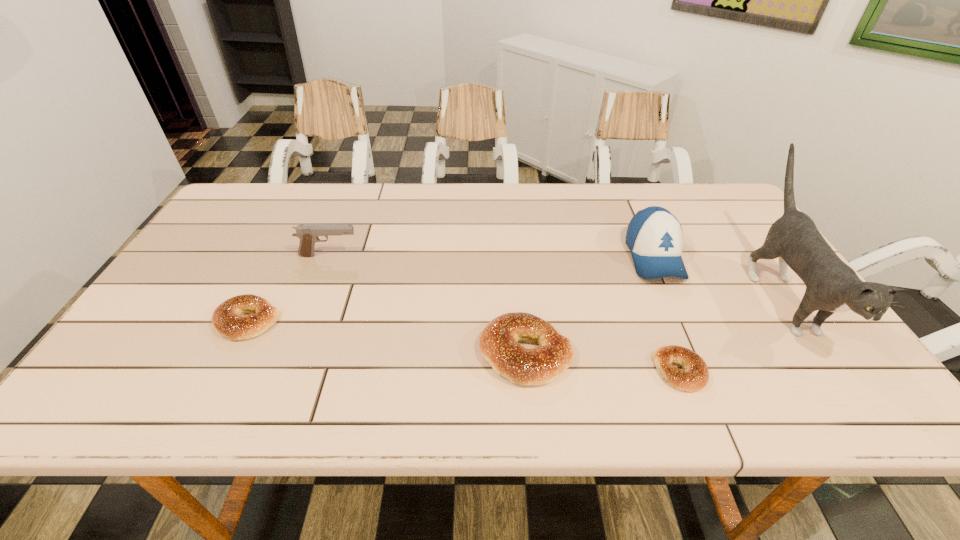
Where is `free space located on the back of the second shortest object`? Image resolution: width=960 pixels, height=540 pixels. free space located on the back of the second shortest object is located at coordinates (281, 255).

Identify the location of free space located 0.350m on the back of the third object from left to right. The height and width of the screenshot is (540, 960). (515, 233).

You are a GUI agent. You are given a task and a screenshot of the screen. Output one action in this format:
    pyautogui.click(x=<x>, y=<y>)
    Task: Click on the vacant region located 0.160m on the left of the shortest object
    
    Given the screenshot: What is the action you would take?
    (x=582, y=371)

Find the location of a particular element. vacant space located at the barrel of the fourth shortest object is located at coordinates tap(384, 255).

At what (x,y) coordinates should I click in order to perform the action: click on free space located on the front-facing side of the second tallest object. Please return your answer as a coordinate pair (x, y). Looking at the image, I should click on (689, 336).

Locate an element on the screen. cat at the near edge is located at coordinates (832, 286).

You are a GUI agent. You are given a task and a screenshot of the screen. Output one action in this format:
    pyautogui.click(x=<x>, y=<y>)
    Task: Click on the object situated at the right edge
    
    Given the screenshot: What is the action you would take?
    pyautogui.click(x=832, y=286)

The width and height of the screenshot is (960, 540). Find the location of `object that is at the near right corner`. object that is at the near right corner is located at coordinates (832, 286).

In the image, there is a desktop. At what (x,y) coordinates should I click in order to perform the action: click on blank space at the far edge. Please return your answer as a coordinate pair (x, y). Image resolution: width=960 pixels, height=540 pixels. Looking at the image, I should click on (579, 224).

In the image, there is a desktop. At what (x,y) coordinates should I click in order to perform the action: click on vacant space at the near edge. Please return your answer as a coordinate pair (x, y). Image resolution: width=960 pixels, height=540 pixels. Looking at the image, I should click on (480, 356).